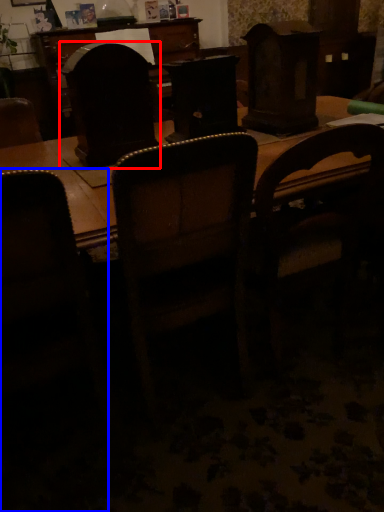
Question: Which object appears closest to the camera in this image, swivel chair (highlighted by a red box) or chair (highlighted by a blue box)?

Choices:
 (A) swivel chair
 (B) chair

Answer: (B)